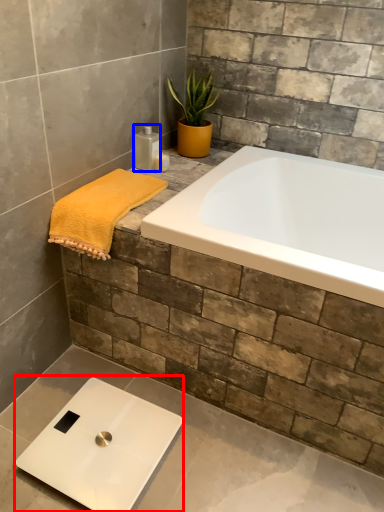
Question: Among these objects, which one is farthest to the camera, scale (highlighted by a red box) or toiletry (highlighted by a blue box)?

Choices:
 (A) scale
 (B) toiletry

Answer: (B)